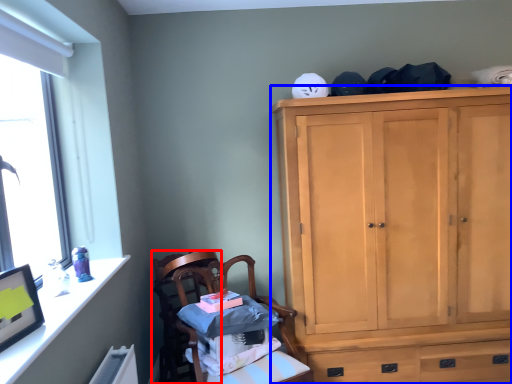
Question: Which of the following is the closest to the observer, chair (highlighted by a red box) or cabinetry (highlighted by a blue box)?

Choices:
 (A) chair
 (B) cabinetry

Answer: (B)